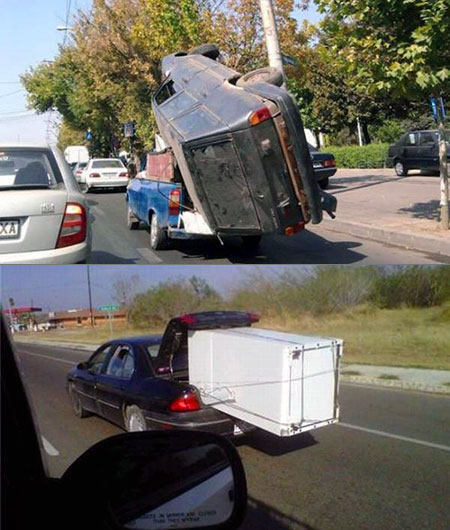
This screenshot has height=530, width=450. I want to click on fridge, so tap(246, 361).